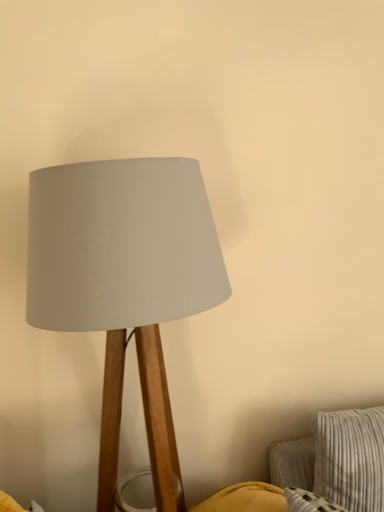
Question: From their relative heights in the image, would you say matte wood lamp at center is taller or shorter than striped fabric pillow at lower right?

Choices:
 (A) short
 (B) tall

Answer: (B)

Question: Choose the correct answer: Is matte wood lamp at center inside striped fabric pillow at lower right or outside it?

Choices:
 (A) outside
 (B) inside

Answer: (A)

Question: Based on their sizes in the image, would you say matte wood lamp at center is bigger or smaller than striped fabric pillow at lower right?

Choices:
 (A) big
 (B) small

Answer: (A)

Question: Based on their positions, is striped fabric pillow at lower right located to the left or right of matte wood lamp at center?

Choices:
 (A) left
 (B) right

Answer: (B)

Question: Considering the positions of point (339, 455) and point (92, 163), is point (339, 455) closer or farther from the camera than point (92, 163)?

Choices:
 (A) closer
 (B) farther

Answer: (B)

Question: In terms of width, does striped fabric pillow at lower right look wider or thinner when compared to matte wood lamp at center?

Choices:
 (A) wide
 (B) thin

Answer: (B)

Question: Relative to matte wood lamp at center, is striped fabric pillow at lower right in front or behind?

Choices:
 (A) behind
 (B) front

Answer: (A)